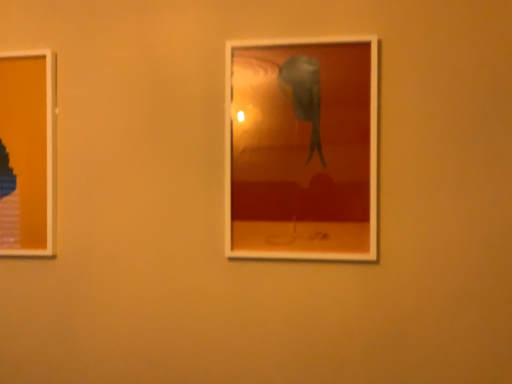
Question: Which direction should I rotate to look at matte plastic picture frame at center, which is the second picture frame in back-to-front order?

Choices:
 (A) left
 (B) right

Answer: (B)

Question: Does matte plastic picture frame at left, positioned as the second picture frame in front-to-back order, come behind matte plastic picture frame at center, which is the second picture frame in back-to-front order?

Choices:
 (A) no
 (B) yes

Answer: (B)

Question: Is matte plastic picture frame at left, the first picture frame positioned from the left, facing towards matte plastic picture frame at center, the 2th picture frame from the left?

Choices:
 (A) yes
 (B) no

Answer: (B)

Question: Is matte plastic picture frame at left, positioned as the second picture frame in front-to-back order, smaller than matte plastic picture frame at center, which is the second picture frame in back-to-front order?

Choices:
 (A) yes
 (B) no

Answer: (A)

Question: Is matte plastic picture frame at left, the second picture frame positioned from the right, completely or partially outside of matte plastic picture frame at center, which is the first picture frame in right-to-left order?

Choices:
 (A) yes
 (B) no

Answer: (A)

Question: Does matte plastic picture frame at left, positioned as the second picture frame in front-to-back order, appear on the right side of matte plastic picture frame at center, the 2th picture frame from the left?

Choices:
 (A) no
 (B) yes

Answer: (A)

Question: Considering the relative sizes of matte plastic picture frame at left, the second picture frame positioned from the right, and matte plastic picture frame at center, which is the first picture frame in right-to-left order, in the image provided, is matte plastic picture frame at left, the second picture frame positioned from the right, wider than matte plastic picture frame at center, which is the first picture frame in right-to-left order,?

Choices:
 (A) yes
 (B) no

Answer: (B)

Question: Is matte plastic picture frame at left, the second picture frame positioned from the right, at the back of matte plastic picture frame at center, which is the second picture frame in back-to-front order?

Choices:
 (A) yes
 (B) no

Answer: (B)

Question: From the image's perspective, does matte plastic picture frame at center, which is the second picture frame in back-to-front order, appear higher than matte plastic picture frame at left, positioned as the 1th picture frame in back-to-front order?

Choices:
 (A) no
 (B) yes

Answer: (B)

Question: Does matte plastic picture frame at center, the 2th picture frame from the left, come in front of matte plastic picture frame at left, positioned as the second picture frame in front-to-back order?

Choices:
 (A) yes
 (B) no

Answer: (A)

Question: Is matte plastic picture frame at center, the 2th picture frame from the left, at the left side of matte plastic picture frame at left, positioned as the 1th picture frame in back-to-front order?

Choices:
 (A) no
 (B) yes

Answer: (A)

Question: Does matte plastic picture frame at center, the 2th picture frame from the left, touch matte plastic picture frame at left, positioned as the 1th picture frame in back-to-front order?

Choices:
 (A) no
 (B) yes

Answer: (A)

Question: Considering the relative positions of matte plastic picture frame at center, which is the second picture frame in back-to-front order, and matte plastic picture frame at left, the first picture frame positioned from the left, in the image provided, is matte plastic picture frame at center, which is the second picture frame in back-to-front order, to the right of matte plastic picture frame at left, the first picture frame positioned from the left, from the viewer's perspective?

Choices:
 (A) no
 (B) yes

Answer: (B)

Question: From the image's perspective, relative to matte plastic picture frame at left, the first picture frame positioned from the left, is matte plastic picture frame at center, marked as the 1th picture frame in a front-to-back arrangement, above or below?

Choices:
 (A) below
 (B) above

Answer: (B)